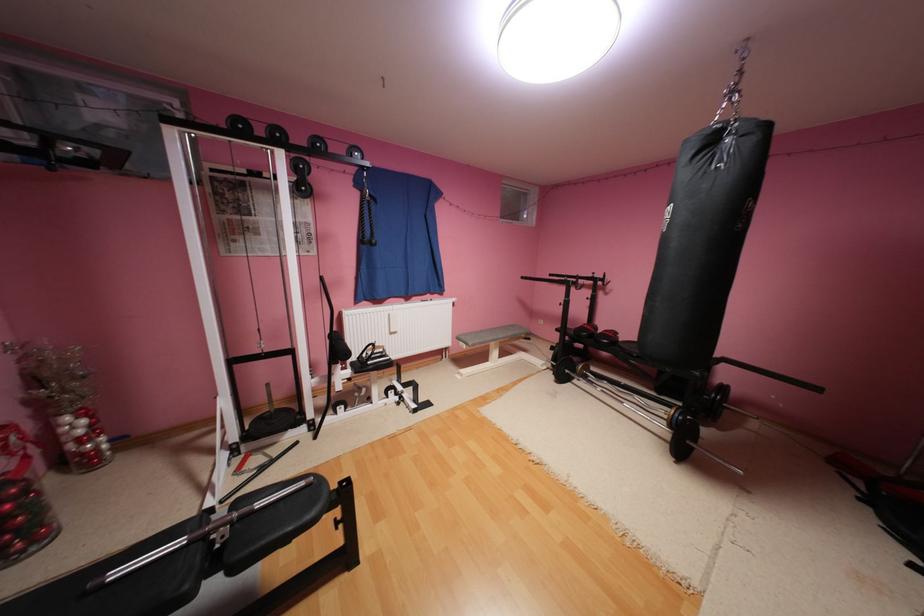
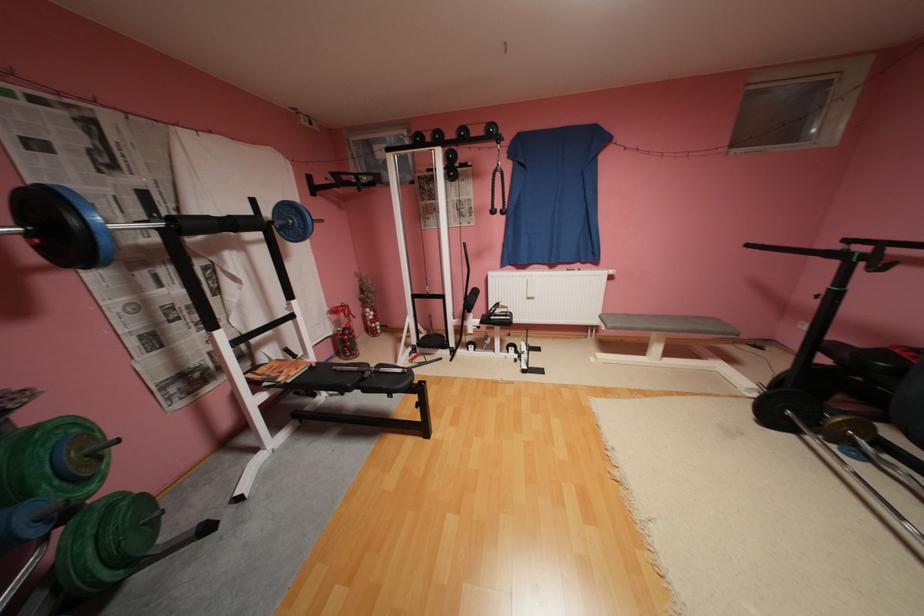
Question: Based on the continuous images, in which direction is the camera rotating? Reply with the corresponding letter.

Choices:
 (A) Left
 (B) Right
 (C) Up
 (D) Down

Answer: (A)